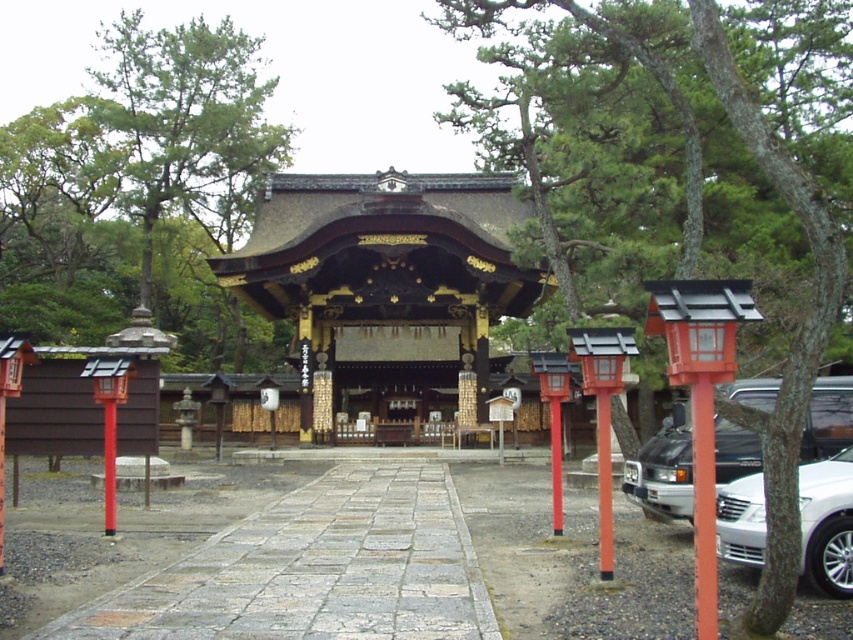
Question: Is metallic silver van at lower right bigger than smooth red pole at left?

Choices:
 (A) no
 (B) yes

Answer: (A)

Question: Which object is farther from the camera taking this photo?

Choices:
 (A) smooth red pole at center
 (B) smooth red pole at left

Answer: (B)

Question: Is white glossy sedan at lower right positioned before smooth orange post at center?

Choices:
 (A) yes
 (B) no

Answer: (A)

Question: Which of the following is the farthest from the observer?

Choices:
 (A) smooth red pole at center
 (B) smooth orange post at center
 (C) metallic silver van at lower right

Answer: (C)

Question: Does green leafy tree at upper center appear under smooth red pole at center?

Choices:
 (A) no
 (B) yes

Answer: (A)

Question: Which of the following is the closest to the observer?

Choices:
 (A) green leafy tree at upper center
 (B) smooth orange post at center
 (C) white glossy sedan at lower right
 (D) gold/woodenobject at center

Answer: (A)